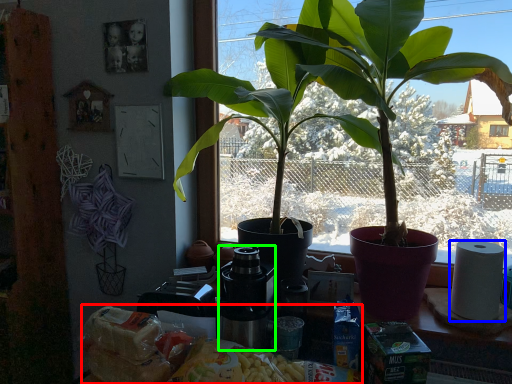
Question: Estimate the real-world distances between objects in this image. Which object is farther from food (highlighted by a red box), paper towel (highlighted by a blue box) or coffee machine (highlighted by a green box)?

Choices:
 (A) paper towel
 (B) coffee machine

Answer: (A)